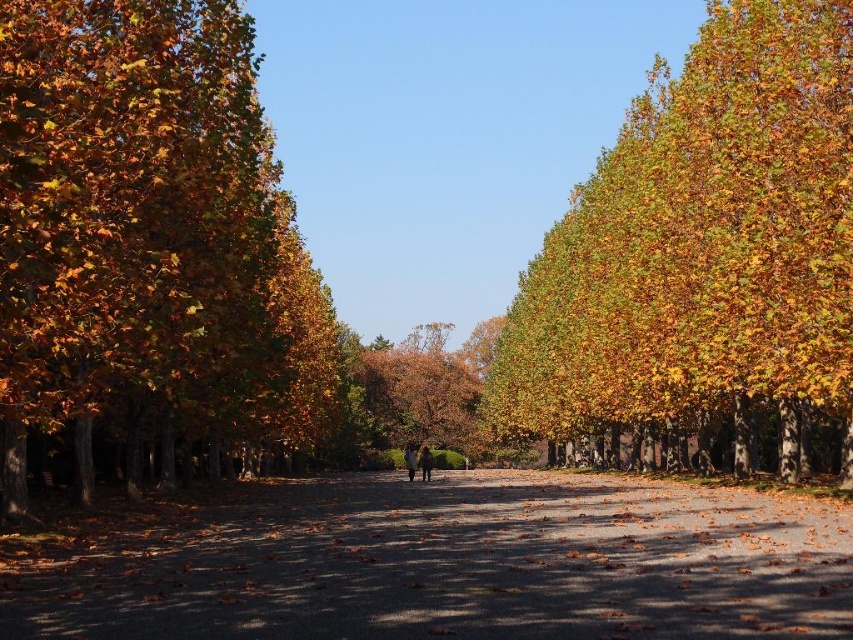
You are a photographer planning to capture the autumn scenery. You notice the golden yellow leaves at upper right and the golden leafy tree at center. Which object would appear closer to the camera based on their size?

The golden yellow leaves at upper right would appear closer to the camera because they have a larger size compared to the golden leafy tree at center.

In the scene shown: You are standing at the center of the pathway in the park. You want to find the golden leafy tree at left. In which direction should you look to see it?

You should look to your left to see the golden leafy tree at left since it is located at point (146,230), which is to the left of the center position.

You are a photographer standing on the pathway in the park scene. You want to capture a photo that includes both the golden leafy tree at left and the golden yellow leaves at upper right. Which object should you focus on first to ensure both are in the frame?

The golden leafy tree at left is closer to the viewer than the golden yellow leaves at upper right, so you should focus on the golden leafy tree at left first to ensure both are in the frame.